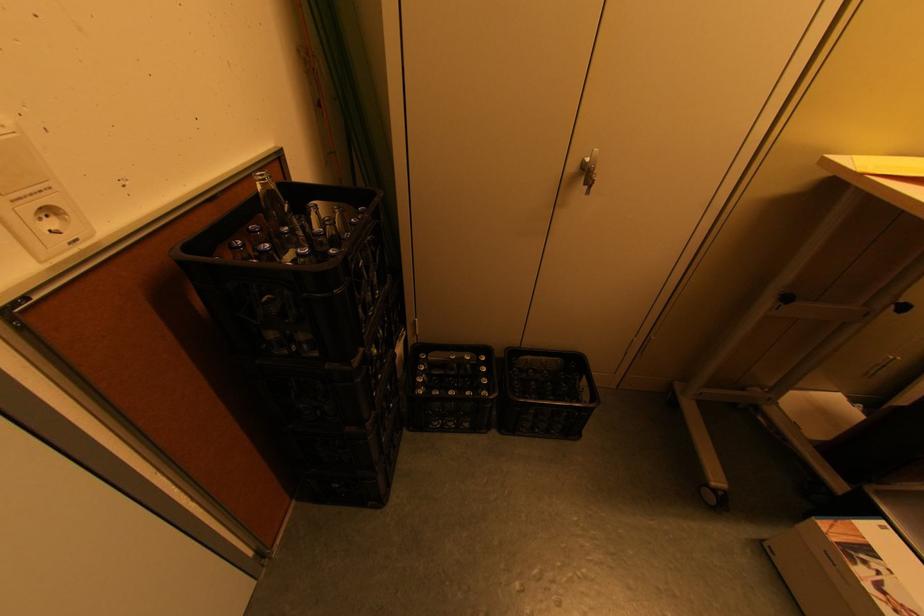
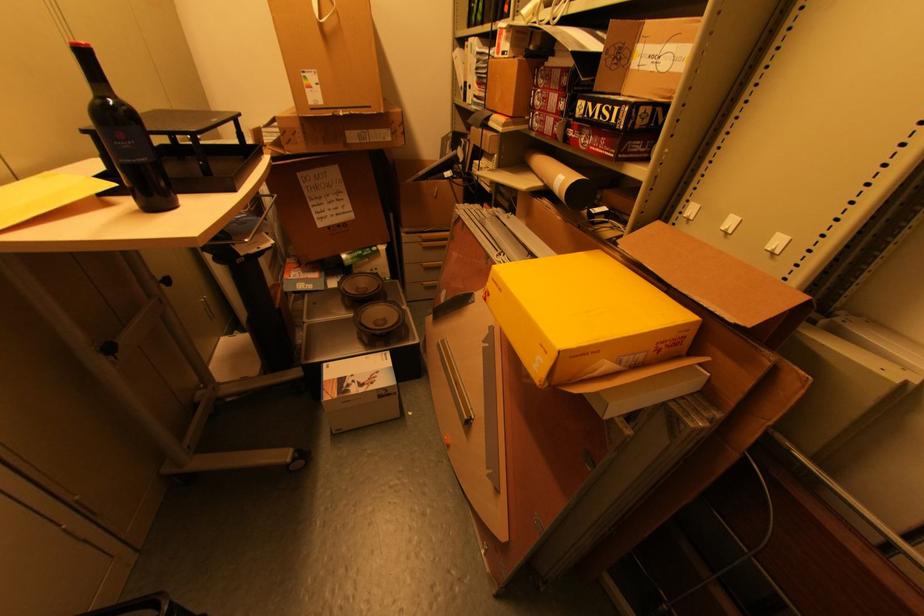
Based on the continuous images, in which direction is the camera rotating?

The camera rotated toward right-down.